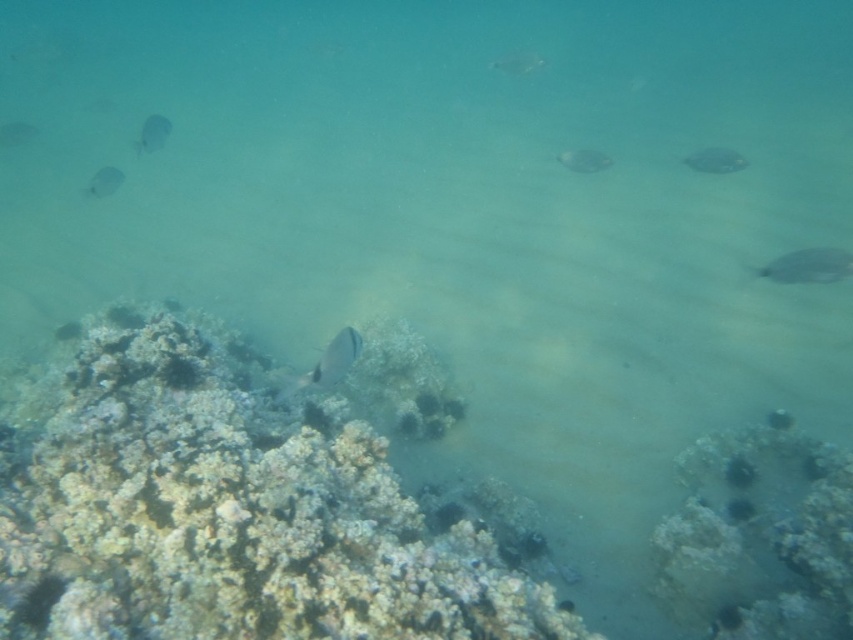
From the picture: You are a marine biologist observing the underwater scene. You notice two fish species in the image. Which fish is smaller in size between the smooth gray fish at center and the translucent gray fish at upper left?

The smooth gray fish at center is smaller in size compared to the translucent gray fish at upper left.

You are a marine biologist observing this underwater scene. You notice the silvery metallic fish at center and the translucent blue fish at upper left. Which fish would cast a larger shadow on the coral reef below?

The silvery metallic fish at center is much taller than the translucent blue fish at upper left, so it would cast a larger shadow on the coral reef below.

You are a marine biologist observing this underwater scene. You notice two fish species here. The silvery metallic fish at center and the smooth silver fish at right. Which fish is closer to you, the observer?

The silvery metallic fish at center is closer to you because it is positioned in front of the smooth silver fish at right.